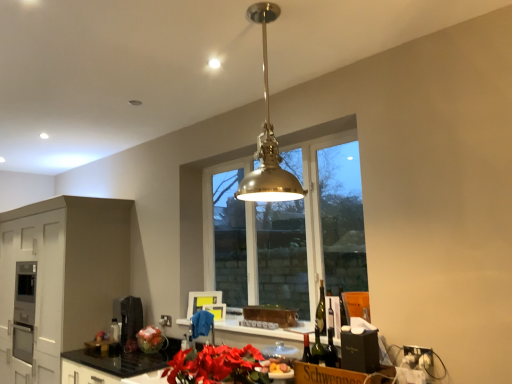
Question: Considering the positions of matte black coffee machine at lower left, which is the first appliance in back-to-front order, and brass/polished metal pendant light at center in the image, is matte black coffee machine at lower left, which is the first appliance in back-to-front order, wider or thinner than brass/polished metal pendant light at center?

Choices:
 (A) thin
 (B) wide

Answer: (A)

Question: Looking at the image, does matte black coffee machine at lower left, marked as the 2th appliance in a right-to-left arrangement, seem bigger or smaller compared to brass/polished metal pendant light at center?

Choices:
 (A) big
 (B) small

Answer: (B)

Question: Which of these objects is positioned farthest from the metallic silver toaster at center, which is counted as the 1th appliance, starting from the front?

Choices:
 (A) black granite countertop at lower center, placed as the first countertop when sorted from right to left
 (B) matte black coffee machine at lower left, which appears as the second appliance when viewed from the front
 (C) white matte cabinetry at lower left
 (D) brown cardboard box at lower right
 (E) matte metallic vase at lower center

Answer: (C)

Question: Which of these objects is positioned farthest from the black granite countertop at lower center, placed as the first countertop when sorted from right to left?

Choices:
 (A) matte black coffee machine at lower left, which appears as the second appliance when viewed from the front
 (B) matte metallic vase at lower center
 (C) clear glass window at center
 (D) brass/polished metal pendant light at center
 (E) black granite countertop at lower center, arranged as the 1th countertop when viewed from the left

Answer: (D)